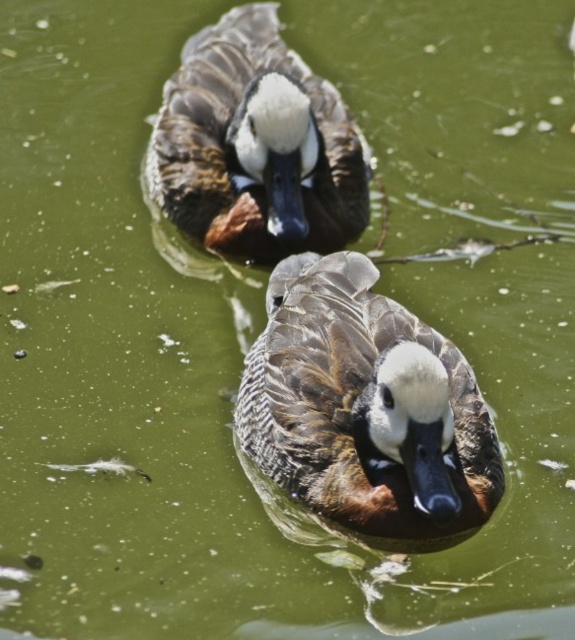
You are observing two brown speckled ducks in a pond. The first duck is labeled as the brown speckled duck at center, and the second is the brown speckled duck at upper center. Based on their positions, which duck is closer to the bottom edge of the image?

The brown speckled duck at center is closer to the bottom edge of the image because it is positioned below the brown speckled duck at upper center.

You are observing two ducks in a pond. The brown speckled duck at center and the brown speckled duck at upper center. Which duck is shorter?

The brown speckled duck at center is shorter than the brown speckled duck at upper center.